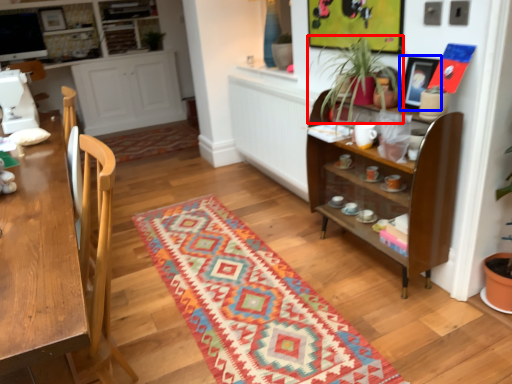
Question: Which of the following is the closest to the observer, houseplant (highlighted by a red box) or picture frame (highlighted by a blue box)?

Choices:
 (A) houseplant
 (B) picture frame

Answer: (A)